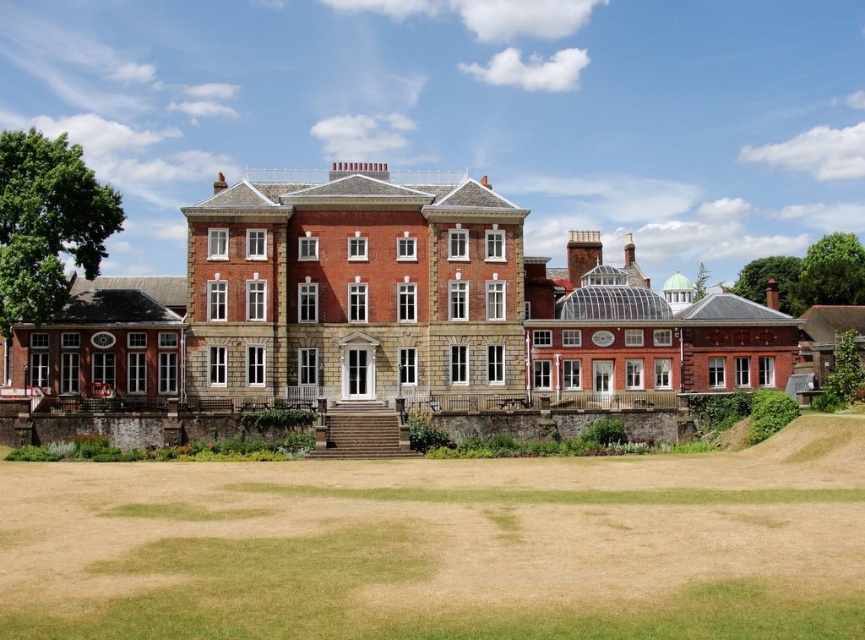
Question: Is the position of brown grass at lower center less distant than that of brick stone mansion at center?

Choices:
 (A) no
 (B) yes

Answer: (B)

Question: Which of the following is the closest to the observer?

Choices:
 (A) brick stone mansion at center
 (B) brown grass at lower center

Answer: (B)

Question: Is brown grass at lower center to the left of brick stone mansion at center from the viewer's perspective?

Choices:
 (A) no
 (B) yes

Answer: (A)

Question: Observing the image, what is the correct spatial positioning of brown grass at lower center in reference to brick stone mansion at center?

Choices:
 (A) left
 (B) right

Answer: (B)